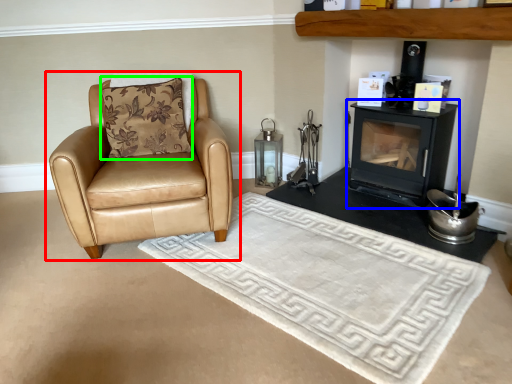
Question: Which object is the farthest from chair (highlighted by a red box)? Choose among these: wood burning stove (highlighted by a blue box) or pillow (highlighted by a green box).

Choices:
 (A) wood burning stove
 (B) pillow

Answer: (A)